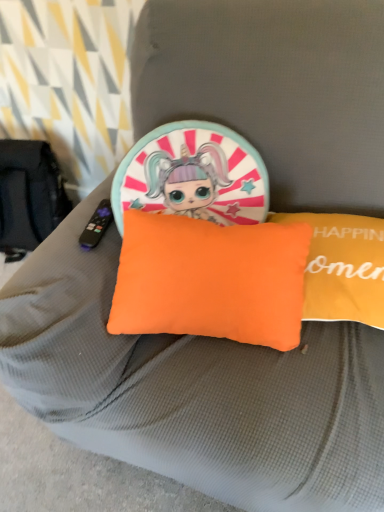
Question: Visually, is orange fabric pillow at center, the 2th pillow viewed from the left, positioned to the left or to the right of orange fabric pillow at center, marked as the first pillow in a left-to-right arrangement?

Choices:
 (A) right
 (B) left

Answer: (A)

Question: In the image, is orange fabric pillow at center, which is counted as the 1th pillow, starting from the right, positioned in front of or behind orange fabric pillow at center, marked as the first pillow in a left-to-right arrangement?

Choices:
 (A) behind
 (B) front

Answer: (A)

Question: In terms of height, does orange fabric pillow at center, the 2th pillow viewed from the left, look taller or shorter compared to orange fabric pillow at center, marked as the first pillow in a left-to-right arrangement?

Choices:
 (A) tall
 (B) short

Answer: (B)

Question: In the image, is orange fabric pillow at center, the second pillow when ordered from right to left, positioned in front of or behind orange fabric pillow at center, which is counted as the 1th pillow, starting from the right?

Choices:
 (A) front
 (B) behind

Answer: (A)

Question: Considering the positions of point (286, 337) and point (344, 233), is point (286, 337) closer or farther from the camera than point (344, 233)?

Choices:
 (A) farther
 (B) closer

Answer: (B)

Question: Is orange fabric pillow at center, marked as the first pillow in a left-to-right arrangement, situated inside orange fabric pillow at center, which is counted as the 1th pillow, starting from the right, or outside?

Choices:
 (A) inside
 (B) outside

Answer: (B)

Question: From the image's perspective, is orange fabric pillow at center, the second pillow when ordered from right to left, positioned above or below orange fabric pillow at center, which is counted as the 1th pillow, starting from the right?

Choices:
 (A) below
 (B) above

Answer: (A)